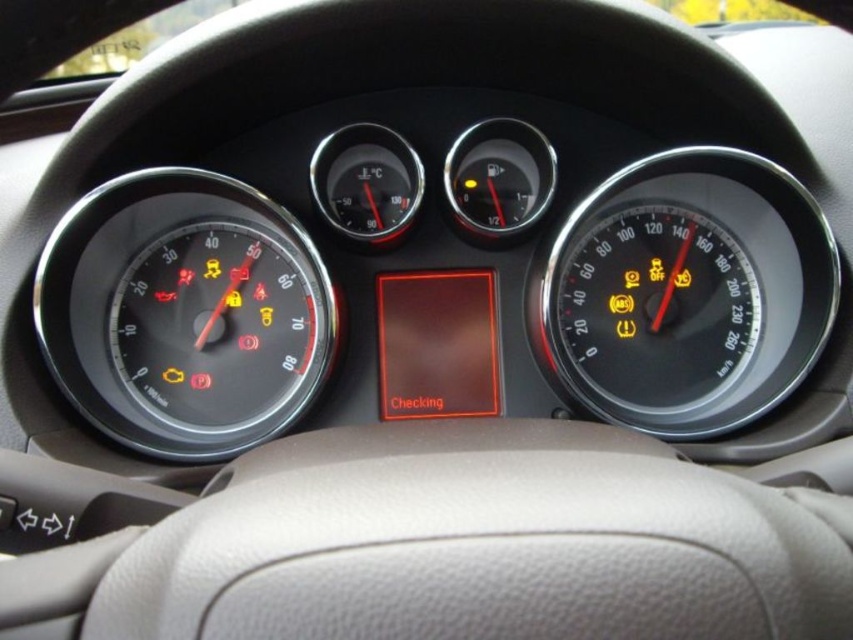
Question: Which of the following is the farthest from the observer?

Choices:
 (A) (621, 241)
 (B) (64, 250)

Answer: (A)

Question: Which of the following is the closest to the observer?

Choices:
 (A) black glossy speedometer at left
 (B) black glossy speedometer at right

Answer: (A)

Question: Does black glossy speedometer at left come behind black glossy speedometer at right?

Choices:
 (A) no
 (B) yes

Answer: (A)

Question: In this image, where is black glossy speedometer at left located relative to black glossy speedometer at right?

Choices:
 (A) above
 (B) below

Answer: (B)

Question: Is black glossy speedometer at left to the right of black glossy speedometer at right from the viewer's perspective?

Choices:
 (A) yes
 (B) no

Answer: (B)